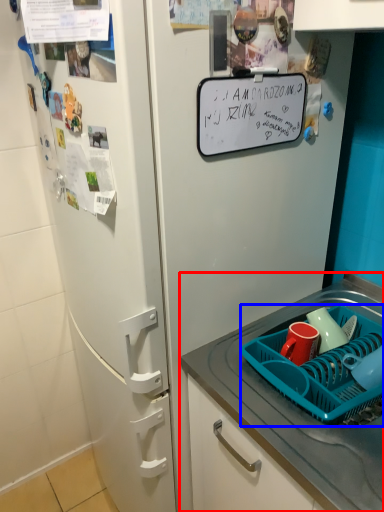
Question: Which of the following is the closest to the observer, desk (highlighted by a red box) or basket (highlighted by a blue box)?

Choices:
 (A) desk
 (B) basket

Answer: (A)